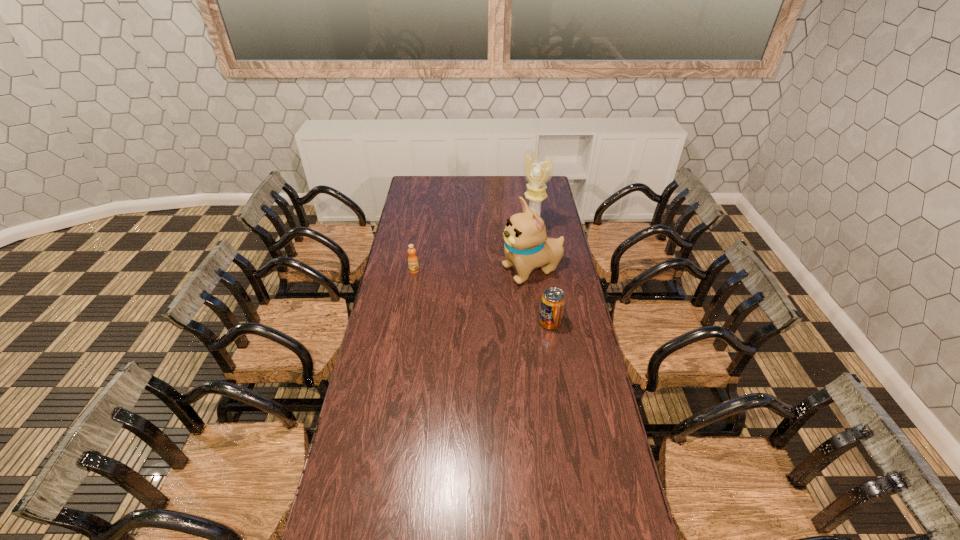
Locate an element on the screen. The height and width of the screenshot is (540, 960). free space on the desktop that is between the leftmost object and the nearest object and is positioned on the front-facing side of the farthest object is located at coordinates (460, 288).

Find the location of `free space on the desktop that is between the orange juice and the nearest object and is positioned on the face of the puppy`. free space on the desktop that is between the orange juice and the nearest object and is positioned on the face of the puppy is located at coordinates (466, 291).